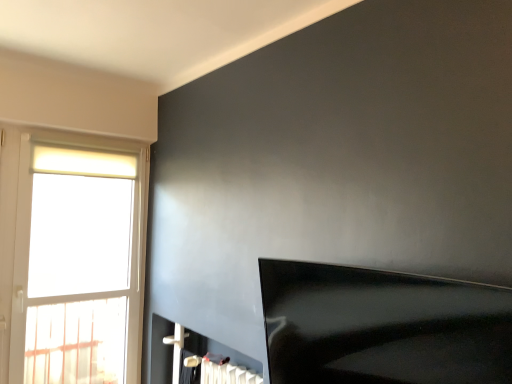
Question: From a real-world perspective, is white glass window at left physically located above or below white glossy fireplace at lower center?

Choices:
 (A) above
 (B) below

Answer: (A)

Question: From the image's perspective, is white glass window at left located above or below white glossy fireplace at lower center?

Choices:
 (A) above
 (B) below

Answer: (A)

Question: Which of these objects is positioned closest to the black glossy tv at lower right?

Choices:
 (A) white glossy fireplace at lower center
 (B) white glass window at left

Answer: (A)

Question: Which of these objects is positioned closest to the white glossy fireplace at lower center?

Choices:
 (A) white glass window at left
 (B) black glossy tv at lower right

Answer: (A)